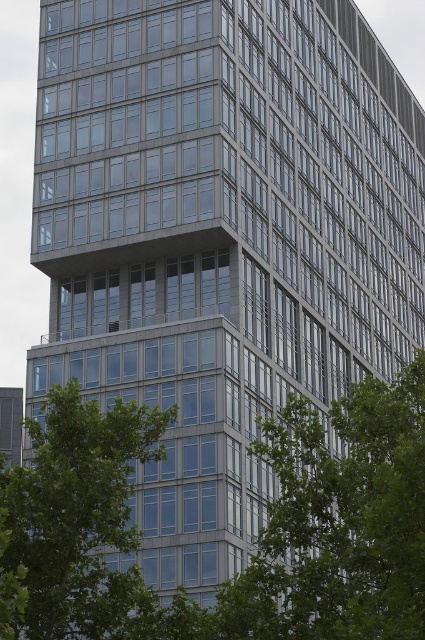
Question: Is green leafy tree at center positioned at the back of green leafy tree at lower left?

Choices:
 (A) no
 (B) yes

Answer: (B)

Question: Among these objects, which one is farthest from the camera?

Choices:
 (A) green leafy tree at lower left
 (B) green leafy tree at center

Answer: (B)

Question: Does green leafy tree at center have a lesser width compared to green leafy tree at lower left?

Choices:
 (A) no
 (B) yes

Answer: (A)

Question: Can you confirm if green leafy tree at center is positioned to the right of green leafy tree at lower left?

Choices:
 (A) yes
 (B) no

Answer: (A)